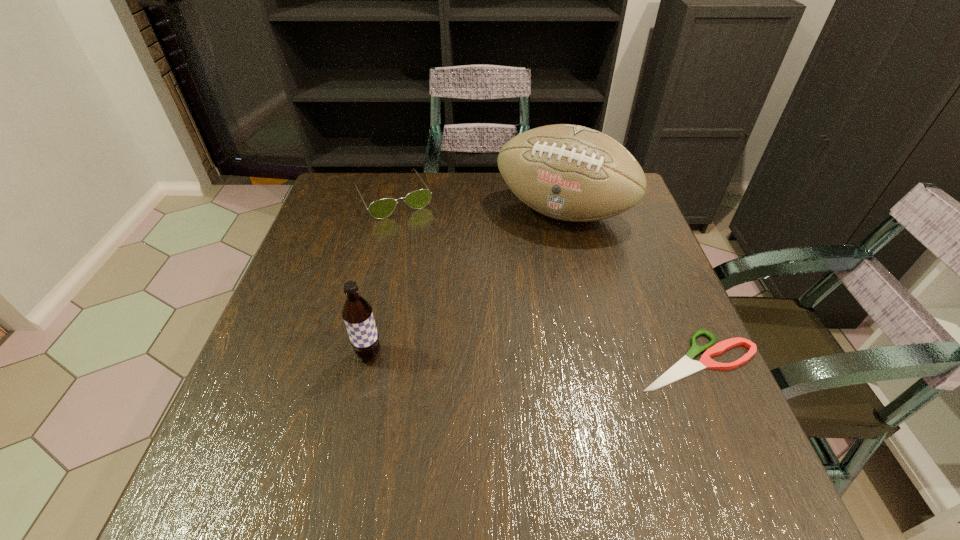
Identify the location of vacant spot on the desktop that is between the second tallest object and the shortest object and is positioned on the laces of the football (American). (493, 357).

Where is `free space on the desktop that is between the root beer and the scissors and is positioned on the front-facing side of the sunglasses`? This screenshot has height=540, width=960. free space on the desktop that is between the root beer and the scissors and is positioned on the front-facing side of the sunglasses is located at coordinates (488, 357).